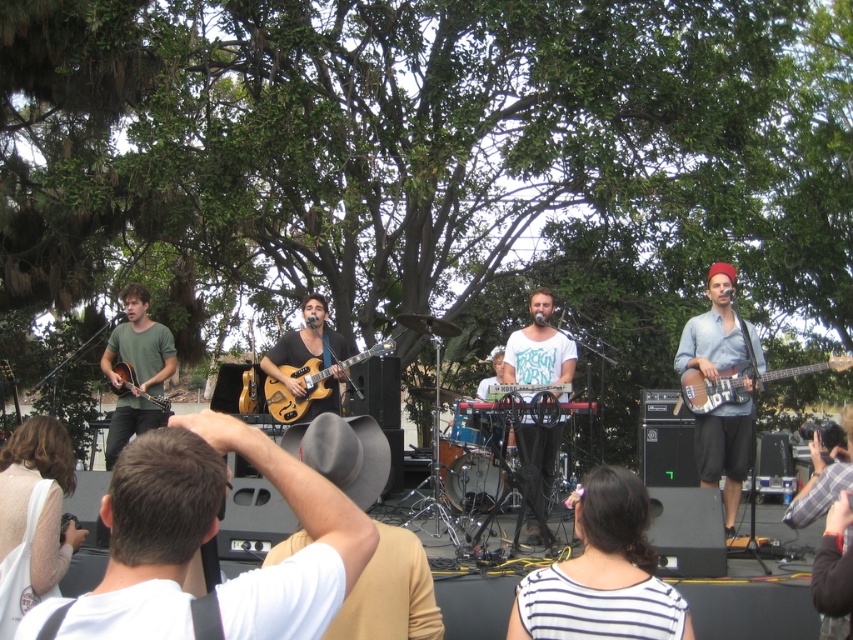
You are a photographer at the front row of the live music performance. You want to take a photo of the matte green shirt at left and the matte brown acoustic guitar at left. Which one is lower in the photo?

The matte green shirt at left is positioned under the matte brown acoustic guitar at left, so the matte green shirt at left will appear lower in the photo.